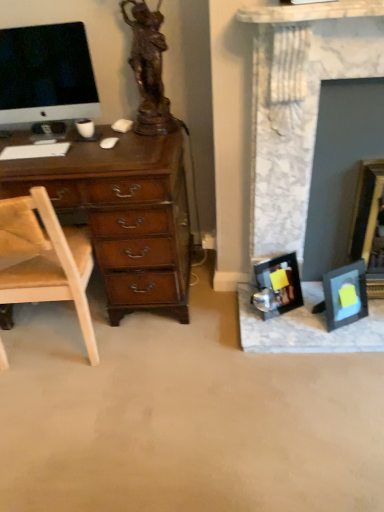
The width and height of the screenshot is (384, 512). Identify the location of matte black picture frame at center, arranged as the first picture frame when viewed from the left. (279, 287).

The width and height of the screenshot is (384, 512). Describe the element at coordinates (279, 287) in the screenshot. I see `matte black picture frame at center, positioned as the third picture frame in right-to-left order` at that location.

Find the location of a particular element. tan leather chair at left is located at coordinates click(x=44, y=259).

What is the approximate height of wooden picture frame at right, which appears as the 3th picture frame when viewed from the left?

wooden picture frame at right, which appears as the 3th picture frame when viewed from the left, is 24.55 inches tall.

What is the approximate width of white matte computer mouse at center-left?

→ It is 4.02 inches.

What is the approximate height of white matte keyboard at left?

It is 2.01 inches.

Measure the distance between point (13, 159) and camera.

Point (13, 159) and camera are 1.67 meters apart.

The height and width of the screenshot is (512, 384). Identify the location of bronze statue at upper left. (149, 70).

Find the location of a particular element. This screenshot has height=512, width=384. matte black picture frame at center, positioned as the third picture frame in right-to-left order is located at coordinates click(x=279, y=287).

Which of these two, white matte keyboard at left or matte brown coffee cup at left, is bigger?

white matte keyboard at left is bigger.

Where is `computer keyboard below the matte brown coffee cup at left (from a real-world perspective)`? The height and width of the screenshot is (512, 384). computer keyboard below the matte brown coffee cup at left (from a real-world perspective) is located at coordinates (35, 151).

Between white matte keyboard at left and matte brown coffee cup at left, which one has more height?

With more height is matte brown coffee cup at left.

How many degrees apart are the facing directions of white matte keyboard at left and matte brown coffee cup at left?

The angle between the facing direction of white matte keyboard at left and the facing direction of matte brown coffee cup at left is 1.43 degrees.

Would you say wooden picture frame at right, which appears as the 3th picture frame when viewed from the left, is inside or outside white matte computer mouse at center-left?

wooden picture frame at right, which appears as the 3th picture frame when viewed from the left, is spatially situated outside white matte computer mouse at center-left.

What's the angular difference between wooden picture frame at right, which appears as the 3th picture frame when viewed from the left, and white matte computer mouse at center-left's facing directions?

The facing directions of wooden picture frame at right, which appears as the 3th picture frame when viewed from the left, and white matte computer mouse at center-left are 7.56 degrees apart.

Is wooden picture frame at right, marked as the 1th picture frame in a right-to-left arrangement, taller than white matte computer mouse at center-left?

Yes.

From the image's perspective, would you say wooden picture frame at right, marked as the 1th picture frame in a right-to-left arrangement, is positioned over white matte computer mouse at center-left?

No, from the image's perspective, wooden picture frame at right, marked as the 1th picture frame in a right-to-left arrangement, is not above white matte computer mouse at center-left.

The width and height of the screenshot is (384, 512). In order to click on sculpture positioned vertically above the satin black monitor at upper left (from a real-world perspective) in this screenshot , I will do `click(149, 70)`.

From the image's perspective, which is below, satin black monitor at upper left or bronze statue at upper left?

From the image's view, satin black monitor at upper left is below.

Who is taller, satin black monitor at upper left or bronze statue at upper left?

bronze statue at upper left.

Which is correct: matte black picture frame at center, positioned as the third picture frame in right-to-left order, is inside satin black monitor at upper left, or outside of it?

The correct answer is: outside.

Does point (267, 272) come in front of point (40, 55)?

That is False.

At what (x,y) coordinates should I click in order to perform the action: click on television that is above the matte black picture frame at center, arranged as the first picture frame when viewed from the left (from a real-world perspective). Please return your answer as a coordinate pair (x, y). Image resolution: width=384 pixels, height=512 pixels. Looking at the image, I should click on (46, 74).

From the image's perspective, is matte black picture frame at center, arranged as the first picture frame when viewed from the left, above or below matte brown coffee cup at left?

matte black picture frame at center, arranged as the first picture frame when viewed from the left, is below matte brown coffee cup at left.

Does point (283, 260) come closer to viewer compared to point (87, 127)?

Yes, it is in front of point (87, 127).

Locate an element on the screen. the 1st picture frame in front of the matte brown coffee cup at left, starting your count from the anchor is located at coordinates (279, 287).

Which object is positioned more to the left, matte black picture frame at center, arranged as the first picture frame when viewed from the left, or matte brown coffee cup at left?

Positioned to the left is matte brown coffee cup at left.

In the image, is matte brown coffee cup at left positioned in front of or behind white matte computer mouse at center-left?

Visually, matte brown coffee cup at left is located behind white matte computer mouse at center-left.

Could you tell me if matte brown coffee cup at left is facing white matte computer mouse at center-left?

No, matte brown coffee cup at left is not aimed at white matte computer mouse at center-left.

Does matte brown coffee cup at left have a larger size compared to white matte computer mouse at center-left?

Yes, matte brown coffee cup at left is bigger than white matte computer mouse at center-left.

Is there a large distance between matte brown coffee cup at left and white matte computer mouse at center-left?

No, there isn't a large distance between matte brown coffee cup at left and white matte computer mouse at center-left.

Based on the photo, how different are the orientations of marble fireplace at right and tan leather chair at left in degrees?

There is a 179-degree angle between the facing directions of marble fireplace at right and tan leather chair at left.

Which is more to the right, marble fireplace at right or tan leather chair at left?

From the viewer's perspective, marble fireplace at right appears more on the right side.

From a real-world perspective, is marble fireplace at right physically located above or below tan leather chair at left?

From a real-world perspective, marble fireplace at right is physically above tan leather chair at left.

Which of these two, marble fireplace at right or tan leather chair at left, stands taller?

marble fireplace at right.

You are a GUI agent. You are given a task and a screenshot of the screen. Output one action in this format:
    pyautogui.click(x=<x>, y=<y>)
    Task: Click on the computer keyboard below the matte brown coffee cup at left (from the image's perspective)
    
    Given the screenshot: What is the action you would take?
    pyautogui.click(x=35, y=151)

Locate an element on the screen. picture frame that is the 1st one below the white matte computer mouse at center-left (from a real-world perspective) is located at coordinates (366, 209).

Considering their positions, is matte black picture frame at center, arranged as the first picture frame when viewed from the left, positioned further to matte brown coffee cup at left than bronze statue at upper left?

matte black picture frame at center, arranged as the first picture frame when viewed from the left, is further to matte brown coffee cup at left.

Looking at this image, based on their spatial positions, is tan leather chair at left or satin black monitor at upper left closer to matte brown coffee cup at left?

satin black monitor at upper left.

Based on the photo, from the image, which object appears to be farther from matte black picture frame at right, which is the 2th picture frame in right-to-left order, matte black picture frame at center, positioned as the third picture frame in right-to-left order, or white matte computer mouse at center-left?

white matte computer mouse at center-left lies further to matte black picture frame at right, which is the 2th picture frame in right-to-left order, than the other object.

Looking at the image, which one is located further to matte black picture frame at center, arranged as the first picture frame when viewed from the left, tan leather chair at left or matte brown coffee cup at left?

matte brown coffee cup at left lies further to matte black picture frame at center, arranged as the first picture frame when viewed from the left, than the other object.

Which object lies further to the anchor point matte brown coffee cup at left, marble fireplace at right or tan leather chair at left?

Based on the image, marble fireplace at right appears to be further to matte brown coffee cup at left.

From the image, which object appears to be farther from matte black picture frame at center, arranged as the first picture frame when viewed from the left, wooden picture frame at right, which appears as the 3th picture frame when viewed from the left, or matte black picture frame at right, which ranks as the 2th picture frame in left-to-right order?

Based on the image, wooden picture frame at right, which appears as the 3th picture frame when viewed from the left, appears to be further to matte black picture frame at center, arranged as the first picture frame when viewed from the left.

Based on their spatial positions, is tan leather chair at left or white matte keyboard at left closer to wooden picture frame at right, marked as the 1th picture frame in a right-to-left arrangement?

tan leather chair at left lies closer to wooden picture frame at right, marked as the 1th picture frame in a right-to-left arrangement, than the other object.

Looking at the image, which one is located further to tan leather chair at left, satin black monitor at upper left or white matte computer mouse at center-left?

satin black monitor at upper left is further to tan leather chair at left.

Locate an element on the screen. computer keyboard that lies between bronze statue at upper left and tan leather chair at left from top to bottom is located at coordinates (35, 151).

Locate an element on the screen. The image size is (384, 512). coffee cup between satin black monitor at upper left and wooden picture frame at right, marked as the 1th picture frame in a right-to-left arrangement, in the horizontal direction is located at coordinates (85, 128).

At what (x,y) coordinates should I click in order to perform the action: click on fireplace located between white matte keyboard at left and wooden picture frame at right, marked as the 1th picture frame in a right-to-left arrangement, in the left-right direction. Please return your answer as a coordinate pair (x, y). This screenshot has height=512, width=384. Looking at the image, I should click on (299, 105).

The height and width of the screenshot is (512, 384). Find the location of `coffee cup between bronze statue at upper left and matte black picture frame at center, arranged as the first picture frame when viewed from the left, from top to bottom`. coffee cup between bronze statue at upper left and matte black picture frame at center, arranged as the first picture frame when viewed from the left, from top to bottom is located at coordinates (85, 128).